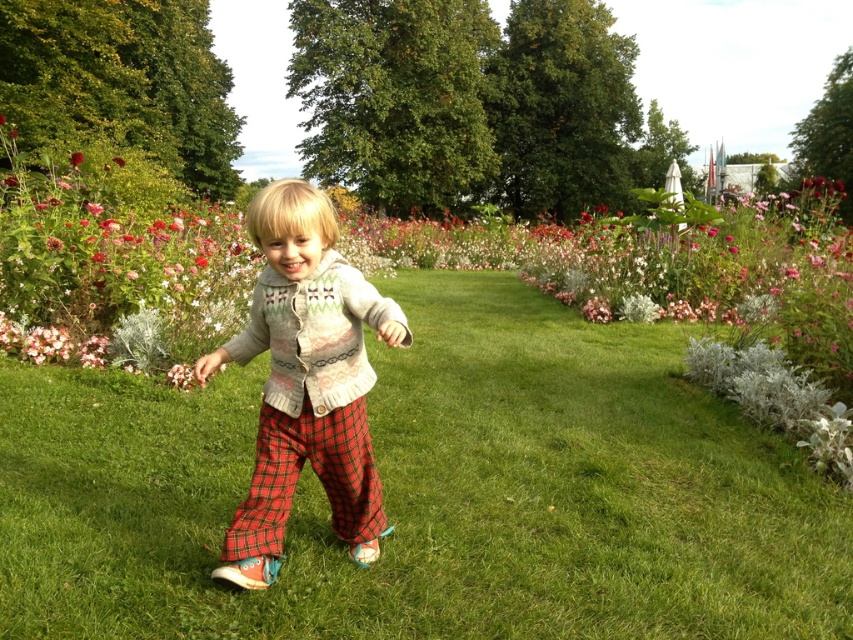
You are a photographer trying to capture the knitted sweater at center and the green grass at center in a single shot. Which object should you focus on first to ensure both are in sharp focus?

The knitted sweater at center is behind the green grass at center, so you should focus on the knitted sweater at center first to ensure both are in sharp focus.

From the picture: You are a gardener who needs to water the green grass at center and the smooth red flower at center. If your watering can holds enough water for 10 meters of travel, can you water both without refilling?

The distance between the green grass at center and the smooth red flower at center is 8.44 meters. Since the watering can can cover 10 meters, you can water both without needing to refill.

You are a photographer standing in the garden and want to take a photo of the green grass at center and the smooth red flower at center. Which object will appear larger in the photo?

The green grass at center will appear larger in the photo because it is closer to the viewer than the smooth red flower at center.